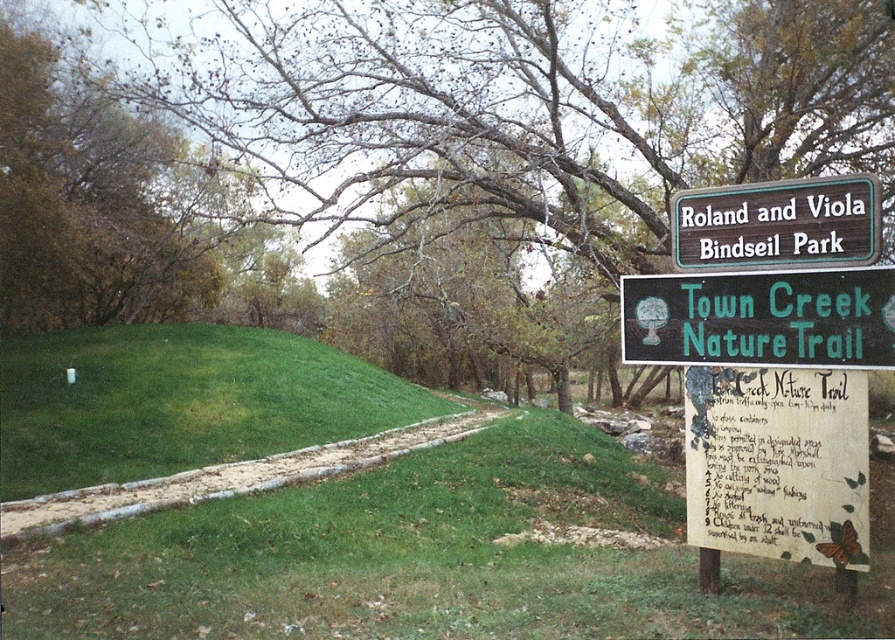
You are a hiker trying to read the trail information. Which of the two signs, the white paper sign at right or the green wooden sign at upper center, is bigger?

The white paper sign at right is larger in size compared to the green wooden sign at upper center.

You are a hiker who wants to take a photo of the white paper sign at right. To get the best shot, you need to stand on a higher elevation. Is the green grassy hillside at lower left a suitable spot for this purpose?

The green grassy hillside at lower left is much taller than the white paper sign at right, so standing on it would provide a higher elevation to take a photo of the sign.